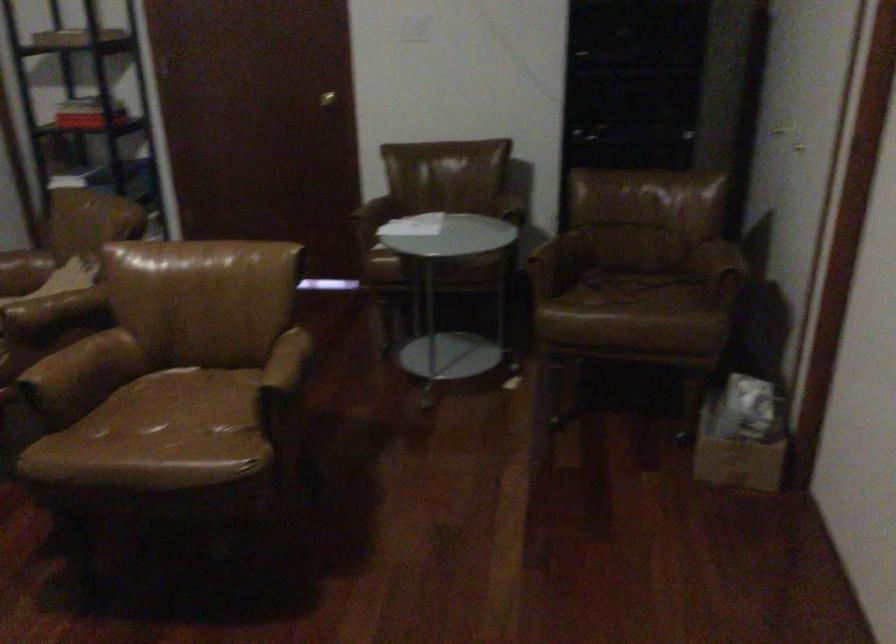
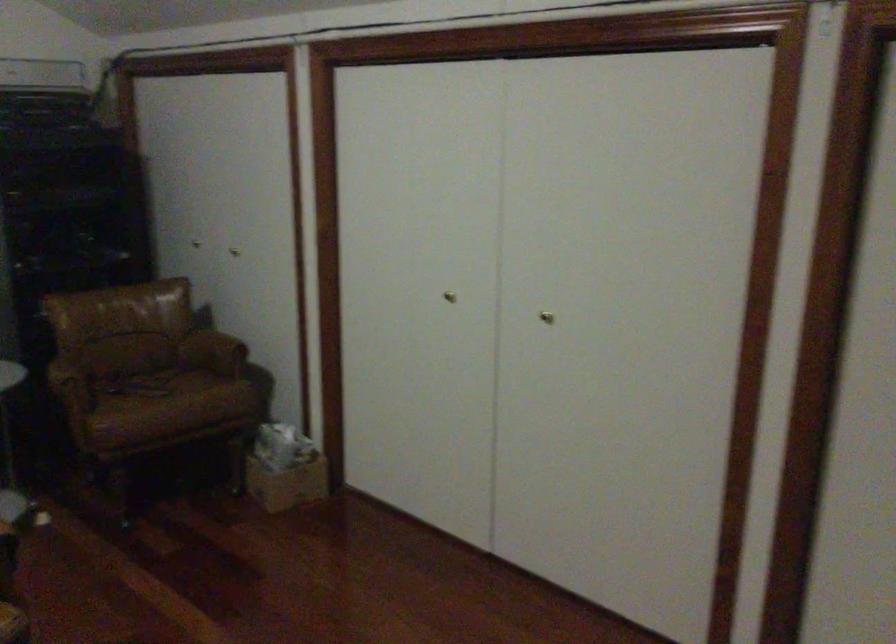
The point at (648, 274) is marked in the first image. Where is the corresponding point in the second image?

(149, 370)